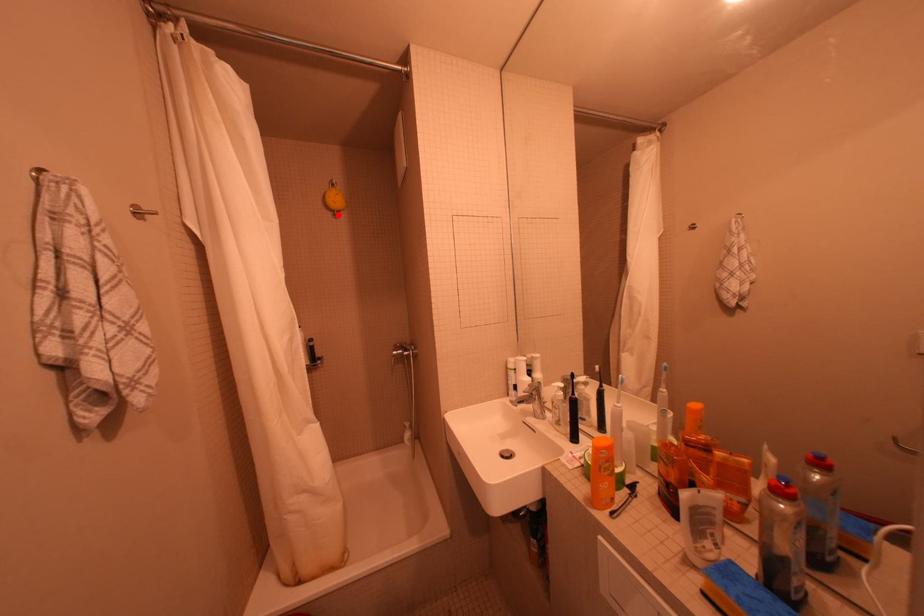
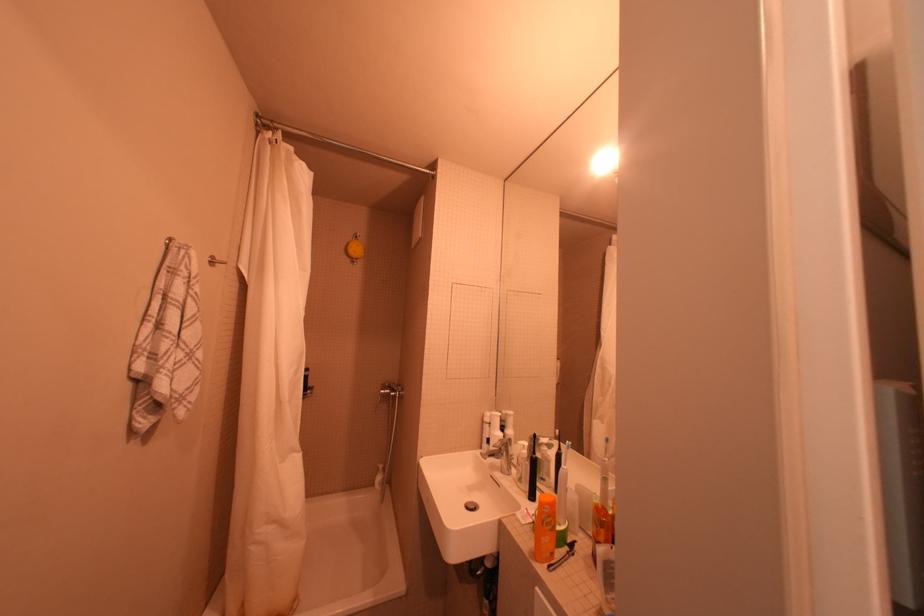
Where in the second image is the point corresponding to the highlighted location from the first image?

(358, 261)